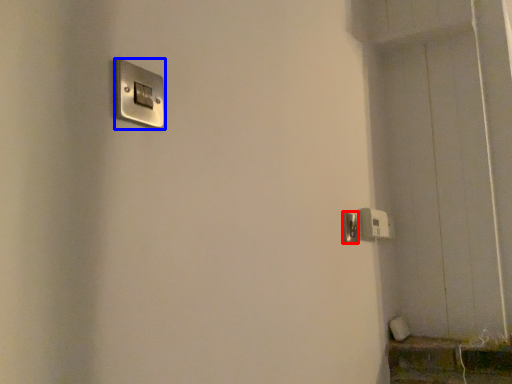
Question: Which of the following is the closest to the observer, door handle (highlighted by a red box) or light switch (highlighted by a blue box)?

Choices:
 (A) door handle
 (B) light switch

Answer: (B)